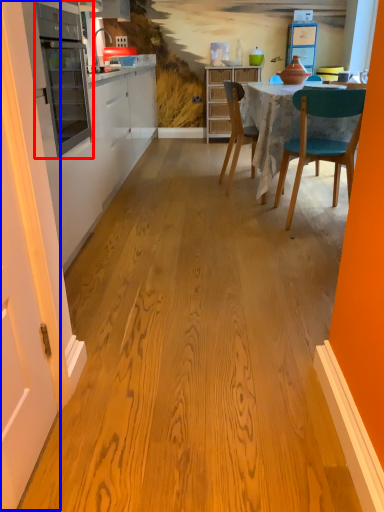
Question: Which of the following is the farthest to the observer, appliance (highlighted by a red box) or door (highlighted by a blue box)?

Choices:
 (A) appliance
 (B) door

Answer: (A)